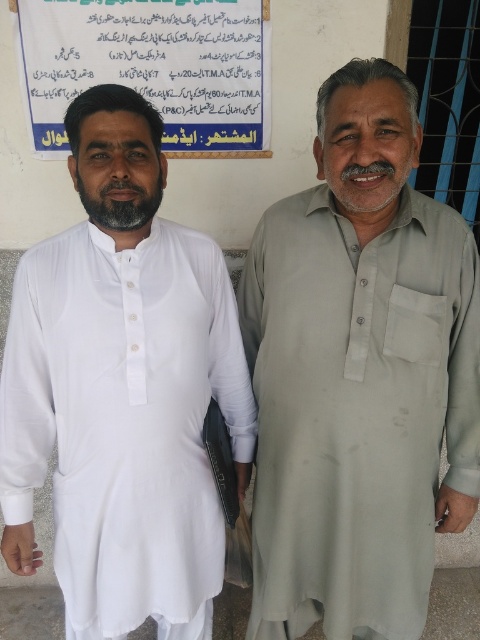
Question: Among these points, which one is nearest to the camera?

Choices:
 (A) (197, 81)
 (B) (459, 426)
 (C) (16, 486)

Answer: (C)

Question: Can you confirm if light gray cotton shirt at right is positioned to the right of white cotton shirt at left?

Choices:
 (A) yes
 (B) no

Answer: (A)

Question: Estimate the real-world distances between objects in this image. Which object is farther from the white cotton shirt at left?

Choices:
 (A) light gray cotton shirt at right
 (B) blue paper at upper center

Answer: (B)

Question: Can you confirm if light gray cotton shirt at right is positioned below blue paper at upper center?

Choices:
 (A) yes
 (B) no

Answer: (A)

Question: Based on their relative distances, which object is farther from the blue paper at upper center?

Choices:
 (A) light gray cotton shirt at right
 (B) white cotton shirt at left

Answer: (B)

Question: Can you confirm if light gray cotton shirt at right is positioned to the left of blue paper at upper center?

Choices:
 (A) yes
 (B) no

Answer: (B)